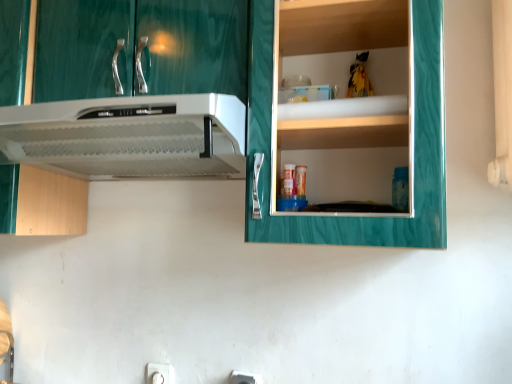
Question: Does white plastic electric outlet at lower center, placed as the 2th electric outlet when sorted from front to back, turn towards white plastic electric outlet at lower center, arranged as the 2th electric outlet when viewed from the back?

Choices:
 (A) yes
 (B) no

Answer: (B)

Question: Is white plastic electric outlet at lower center, placed as the 2th electric outlet when sorted from front to back, thinner than white plastic electric outlet at lower center, the 1th electric outlet from the right?

Choices:
 (A) yes
 (B) no

Answer: (A)

Question: Is white plastic electric outlet at lower center, which ranks as the 2th electric outlet in right-to-left order, positioned with its back to white plastic electric outlet at lower center, arranged as the 2th electric outlet when viewed from the back?

Choices:
 (A) no
 (B) yes

Answer: (A)

Question: Is white plastic electric outlet at lower center, the first electric outlet in the back-to-front sequence, not close to white plastic electric outlet at lower center, the 1th electric outlet from the right?

Choices:
 (A) yes
 (B) no

Answer: (B)

Question: From a real-world perspective, is white plastic electric outlet at lower center, which ranks as the 2th electric outlet in right-to-left order, located higher than white plastic electric outlet at lower center, marked as the first electric outlet in a front-to-back arrangement?

Choices:
 (A) yes
 (B) no

Answer: (B)

Question: Would you say white plastic electric outlet at lower center, marked as the first electric outlet in a front-to-back arrangement, is part of white plastic electric outlet at lower center, placed as the 2th electric outlet when sorted from front to back,'s contents?

Choices:
 (A) no
 (B) yes

Answer: (A)

Question: From the image's perspective, is white plastic range hood at upper left over white plastic electric outlet at lower center, arranged as the 2th electric outlet when viewed from the back?

Choices:
 (A) yes
 (B) no

Answer: (A)

Question: From a real-world perspective, is white plastic range hood at upper left on white plastic electric outlet at lower center, marked as the first electric outlet in a front-to-back arrangement?

Choices:
 (A) no
 (B) yes

Answer: (B)

Question: Considering the relative sizes of white plastic range hood at upper left and white plastic electric outlet at lower center, marked as the first electric outlet in a front-to-back arrangement, in the image provided, is white plastic range hood at upper left smaller than white plastic electric outlet at lower center, marked as the first electric outlet in a front-to-back arrangement,?

Choices:
 (A) yes
 (B) no

Answer: (B)

Question: Can you confirm if white plastic range hood at upper left is wider than white plastic electric outlet at lower center, marked as the first electric outlet in a front-to-back arrangement?

Choices:
 (A) no
 (B) yes

Answer: (B)

Question: Does white plastic range hood at upper left appear on the left side of white plastic electric outlet at lower center, the 1th electric outlet from the right?

Choices:
 (A) no
 (B) yes

Answer: (B)

Question: From a real-world perspective, is white plastic range hood at upper left located beneath white plastic electric outlet at lower center, arranged as the 2th electric outlet when viewed from the back?

Choices:
 (A) no
 (B) yes

Answer: (A)

Question: Is white plastic electric outlet at lower center, arranged as the 2th electric outlet when viewed from the back, bigger than white plastic electric outlet at lower center, the first electric outlet in the back-to-front sequence?

Choices:
 (A) no
 (B) yes

Answer: (B)